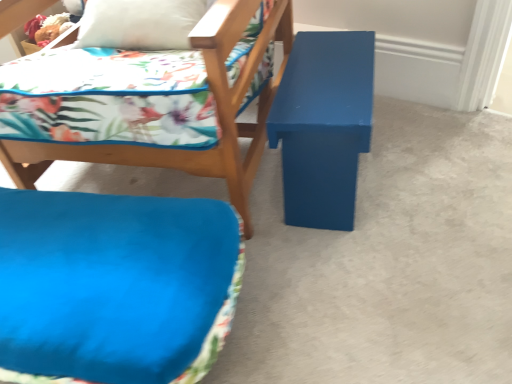
What do you see at coordinates (114, 287) in the screenshot? The width and height of the screenshot is (512, 384). I see `blue fabric cushion at lower left` at bounding box center [114, 287].

What are the coordinates of `matte blue bench at right` in the screenshot? It's located at (323, 125).

From the image's perspective, which is below, blue fabric cushion at lower left or matte blue bench at right?

blue fabric cushion at lower left appears lower in the image.

Which of these two, blue fabric cushion at lower left or matte blue bench at right, is smaller?

With smaller size is matte blue bench at right.

Is blue fabric cushion at lower left far away from matte blue bench at right?

They are positioned close to each other.

How different are the orientations of blue fabric cushion at lower left and matte blue bench at right in degrees?

The angular difference between blue fabric cushion at lower left and matte blue bench at right is 0.00014 degrees.

How different are the orientations of matte blue cushion at center and blue fabric cushion at lower left in degrees?

They differ by 8.7e-05 degrees in their facing directions.

From the image's perspective, would you say matte blue cushion at center is positioned over blue fabric cushion at lower left?

Yes, from the image's perspective, matte blue cushion at center is over blue fabric cushion at lower left.

Between matte blue cushion at center and blue fabric cushion at lower left, which one has less height?

With less height is blue fabric cushion at lower left.

Is matte blue cushion at center aimed at blue fabric cushion at lower left?

Yes, matte blue cushion at center is oriented towards blue fabric cushion at lower left.

Is blue fabric cushion at lower left turned away from blue matte bench at center?

That's right, blue fabric cushion at lower left is facing away from blue matte bench at center.

Is blue matte bench at center completely or partially inside blue fabric cushion at lower left?

Actually, blue matte bench at center is outside blue fabric cushion at lower left.

Is blue fabric cushion at lower left positioned before blue matte bench at center?

Yes.

Consider the image. Considering the relative positions of matte blue bench at right and blue matte bench at center in the image provided, is matte blue bench at right behind blue matte bench at center?

Yes, it is behind blue matte bench at center.

Considering the relative positions of matte blue bench at right and blue matte bench at center in the image provided, is matte blue bench at right to the right of blue matte bench at center from the viewer's perspective?

Yes, matte blue bench at right is to the right of blue matte bench at center.

Would you consider matte blue bench at right to be distant from blue matte bench at center?

No.

This screenshot has height=384, width=512. I want to click on table that appears above the blue matte bench at center (from the image's perspective), so click(x=323, y=125).

Between blue matte bench at center and matte blue cushion at center, which one has less height?

Standing shorter between the two is blue matte bench at center.

Is blue matte bench at center located outside matte blue cushion at center?

blue matte bench at center is positioned outside matte blue cushion at center.

Looking at their sizes, would you say blue matte bench at center is wider or thinner than matte blue cushion at center?

blue matte bench at center is wider than matte blue cushion at center.

Would you say matte blue cushion at center is inside or outside blue matte bench at center?

matte blue cushion at center exists outside the volume of blue matte bench at center.

Which of these two, matte blue cushion at center or blue matte bench at center, stands shorter?

blue matte bench at center is shorter.

Which is more to the left, matte blue cushion at center or blue matte bench at center?

matte blue cushion at center is more to the left.

Which object is thinner, matte blue cushion at center or blue matte bench at center?

matte blue cushion at center is thinner.

Between matte blue bench at right and matte blue cushion at center, which one has smaller size?

matte blue bench at right.

From a real-world perspective, which object rests below the other?

matte blue bench at right, from a real-world perspective.

Where is `chair lying above the matte blue bench at right (from the image's perspective)`? The height and width of the screenshot is (384, 512). chair lying above the matte blue bench at right (from the image's perspective) is located at coordinates (216, 110).

Which object is closer to the camera taking this photo, matte blue bench at right or matte blue cushion at center?

matte blue cushion at center.

You are a GUI agent. You are given a task and a screenshot of the screen. Output one action in this format:
    pyautogui.click(x=<x>, y=<y>)
    Task: Click on the furniture in front of the matte blue bench at right
    
    Given the screenshot: What is the action you would take?
    pyautogui.click(x=114, y=287)

The width and height of the screenshot is (512, 384). I want to click on chair that is above the blue fabric cushion at lower left (from the image's perspective), so click(x=216, y=110).

Based on their spatial positions, is matte blue bench at right or blue matte bench at center further from blue fabric cushion at lower left?

matte blue bench at right lies further to blue fabric cushion at lower left than the other object.

When comparing their distances from blue matte bench at center, does blue fabric cushion at lower left or matte blue bench at right seem closer?

matte blue bench at right is closer to blue matte bench at center.

Estimate the real-world distances between objects in this image. Which object is further from matte blue cushion at center, blue matte bench at center or blue fabric cushion at lower left?

Among the two, blue matte bench at center is located further to matte blue cushion at center.

Which object lies further to the anchor point blue matte bench at center, matte blue cushion at center or matte blue bench at right?

Among the two, matte blue cushion at center is located further to blue matte bench at center.

From the image, which object appears to be nearer to blue fabric cushion at lower left, blue matte bench at center or matte blue bench at right?

Among the two, blue matte bench at center is located nearer to blue fabric cushion at lower left.

From the image, which object appears to be nearer to matte blue bench at right, blue fabric cushion at lower left or matte blue cushion at center?

matte blue cushion at center.

Which object lies nearer to the anchor point blue fabric cushion at lower left, matte blue bench at right or matte blue cushion at center?

matte blue cushion at center lies closer to blue fabric cushion at lower left than the other object.

From the image, which object appears to be farther from matte blue bench at right, blue matte bench at center or matte blue cushion at center?

The object further to matte blue bench at right is blue matte bench at center.

The height and width of the screenshot is (384, 512). I want to click on concrete between matte blue cushion at center and blue fabric cushion at lower left in the up-down direction, so click(387, 264).

What are the coordinates of `concrete between matte blue cushion at center and matte blue bench at right from left to right` in the screenshot? It's located at (387, 264).

Find the location of `concrete between blue fabric cushion at lower left and matte blue bench at right`. concrete between blue fabric cushion at lower left and matte blue bench at right is located at coordinates (387, 264).

The width and height of the screenshot is (512, 384). Find the location of `chair between blue fabric cushion at lower left and matte blue bench at right`. chair between blue fabric cushion at lower left and matte blue bench at right is located at coordinates (216, 110).